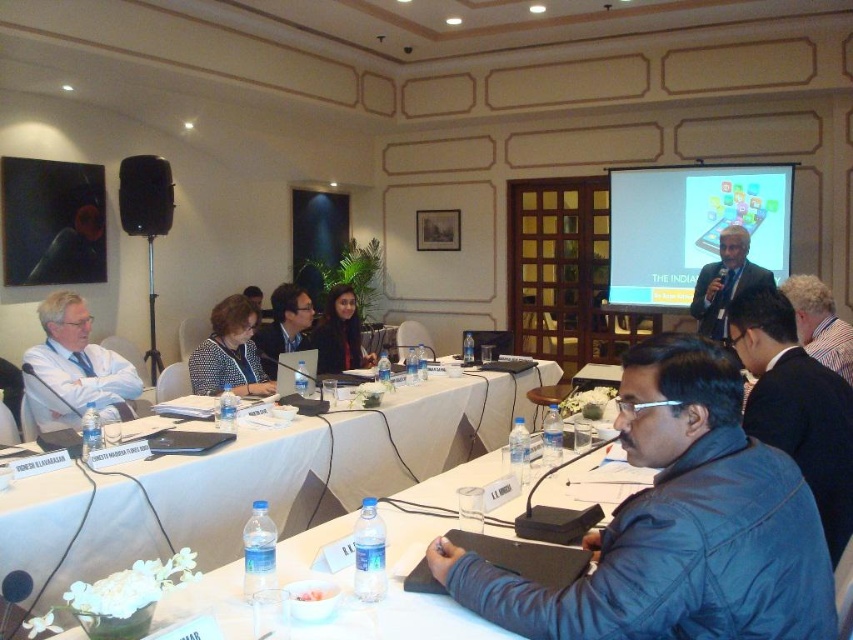
Which is in front, point (263, 436) or point (837, 541)?

Positioned in front is point (837, 541).

Is point (416, 400) positioned before point (773, 410)?

No, (416, 400) is behind (773, 410).

What do you see at coordinates (329, 458) in the screenshot? I see `white plastic table at center` at bounding box center [329, 458].

This screenshot has width=853, height=640. Find the location of `white plastic table at center`. white plastic table at center is located at coordinates (329, 458).

Between matte black screen at upper right and matte black laptop at center, which one has more height?

matte black screen at upper right

Does matte black screen at upper right appear over matte black laptop at center?

Yes.

Is point (675, 241) positioned before point (271, 330)?

That is False.

I want to click on matte black screen at upper right, so click(x=691, y=227).

Does patterned fabric shirt at center have a greater width compared to matte black laptop at left?

Correct, the width of patterned fabric shirt at center exceeds that of matte black laptop at left.

Between point (190, 374) and point (97, 282), which one is positioned in front?

Point (190, 374)

Where is `patterned fabric shirt at center`? This screenshot has width=853, height=640. patterned fabric shirt at center is located at coordinates (229, 353).